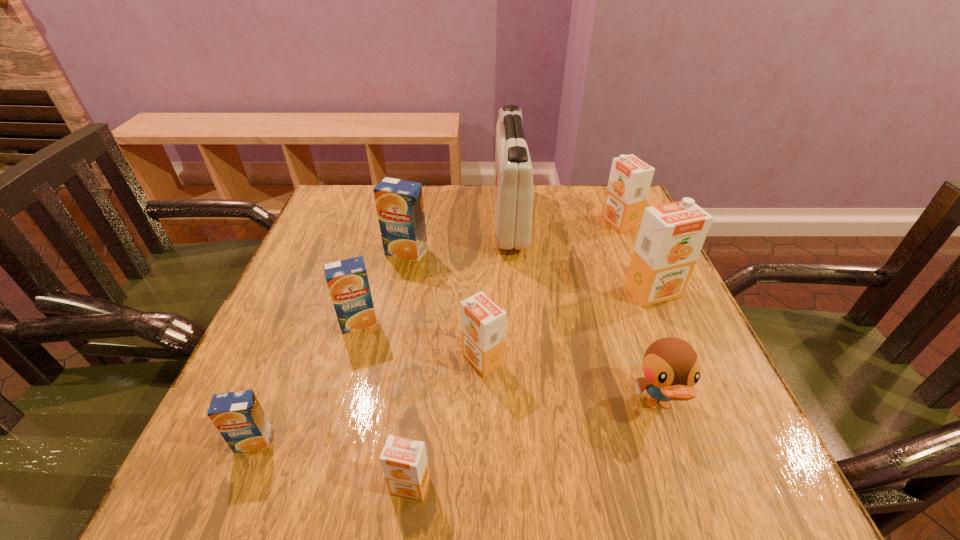
You are a GUI agent. You are given a task and a screenshot of the screen. Output one action in this format:
    pyautogui.click(x=<x>, y=<y>)
    Task: Click on the empty location between the fourth nearest orange juice and the biggest orange orange juice
    
    Given the screenshot: What is the action you would take?
    pyautogui.click(x=506, y=307)

This screenshot has width=960, height=540. In order to click on vacant point located between the biggest blue orange_juice and the red first-aid kit in this screenshot , I will do `click(458, 235)`.

You are a GUI agent. You are given a task and a screenshot of the screen. Output one action in this format:
    pyautogui.click(x=<x>, y=<y>)
    Task: Click on the free space between the smallest orange orange juice and the second orange orange juice from left to right
    The width and height of the screenshot is (960, 540).
    Given the screenshot: What is the action you would take?
    pyautogui.click(x=446, y=422)

Locate an element on the screen. The height and width of the screenshot is (540, 960). free space between the second farthest orange juice and the duck is located at coordinates (532, 328).

You are a GUI agent. You are given a task and a screenshot of the screen. Output one action in this format:
    pyautogui.click(x=<x>, y=<y>)
    Task: Click on the vacant area that lies between the fifth farthest object and the leftmost object
    This screenshot has width=960, height=540.
    Given the screenshot: What is the action you would take?
    pyautogui.click(x=306, y=381)

Locate an element on the screen. The width and height of the screenshot is (960, 540). empty space between the second biggest orange orange juice and the nearest blue orange_juice is located at coordinates (437, 332).

Select which object appears as the second closest to the smallest orange orange juice. Please provide its 2D coordinates. Your answer should be formatted as a tuple, i.e. [(x, y)], where the tuple contains the x and y coordinates of a point satisfying the conditions above.

[(238, 416)]

Where is `the sixth closest object to the farthest orange juice`? This screenshot has height=540, width=960. the sixth closest object to the farthest orange juice is located at coordinates (347, 280).

Point out which orange juice is positioned as the nearest to the third smallest orange orange juice. Please provide its 2D coordinates. Your answer should be formatted as a tuple, i.e. [(x, y)], where the tuple contains the x and y coordinates of a point satisfying the conditions above.

[(671, 236)]

Locate which orange juice ranks second in proximity to the third orange juice from right to left. Please provide its 2D coordinates. Your answer should be formatted as a tuple, i.e. [(x, y)], where the tuple contains the x and y coordinates of a point satisfying the conditions above.

[(404, 462)]